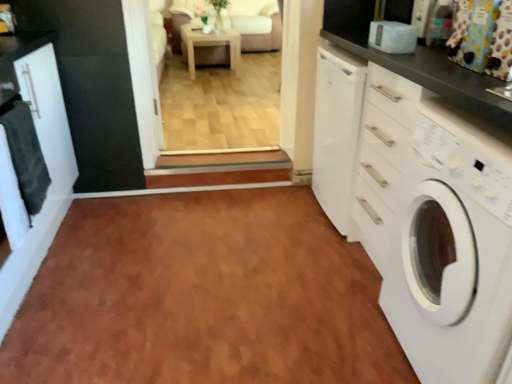
Question: Can you confirm if brown laminate floor at center is bigger than dark gray towel at left?

Choices:
 (A) no
 (B) yes

Answer: (B)

Question: Is brown laminate floor at center smaller than dark gray towel at left?

Choices:
 (A) no
 (B) yes

Answer: (A)

Question: Is brown laminate floor at center taller than dark gray towel at left?

Choices:
 (A) no
 (B) yes

Answer: (A)

Question: From the image's perspective, is brown laminate floor at center beneath dark gray towel at left?

Choices:
 (A) no
 (B) yes

Answer: (B)

Question: From the image's perspective, does brown laminate floor at center appear higher than dark gray towel at left?

Choices:
 (A) yes
 (B) no

Answer: (B)

Question: Is brown laminate floor at center with dark gray towel at left?

Choices:
 (A) no
 (B) yes

Answer: (A)

Question: Is brown laminate floor at center in front of white glossy washing machine at right?

Choices:
 (A) yes
 (B) no

Answer: (B)

Question: Can you confirm if brown laminate floor at center is thinner than white glossy washing machine at right?

Choices:
 (A) no
 (B) yes

Answer: (A)

Question: Is brown laminate floor at center bigger than white glossy washing machine at right?

Choices:
 (A) yes
 (B) no

Answer: (B)

Question: Is brown laminate floor at center next to white glossy washing machine at right and touching it?

Choices:
 (A) yes
 (B) no

Answer: (B)

Question: Can you confirm if brown laminate floor at center is shorter than white glossy washing machine at right?

Choices:
 (A) no
 (B) yes

Answer: (B)

Question: Is brown laminate floor at center wider than white glossy washing machine at right?

Choices:
 (A) no
 (B) yes

Answer: (B)

Question: From a real-world perspective, is multicolored fabric curtain at upper right located beneath white glossy cabinet at left?

Choices:
 (A) yes
 (B) no

Answer: (B)